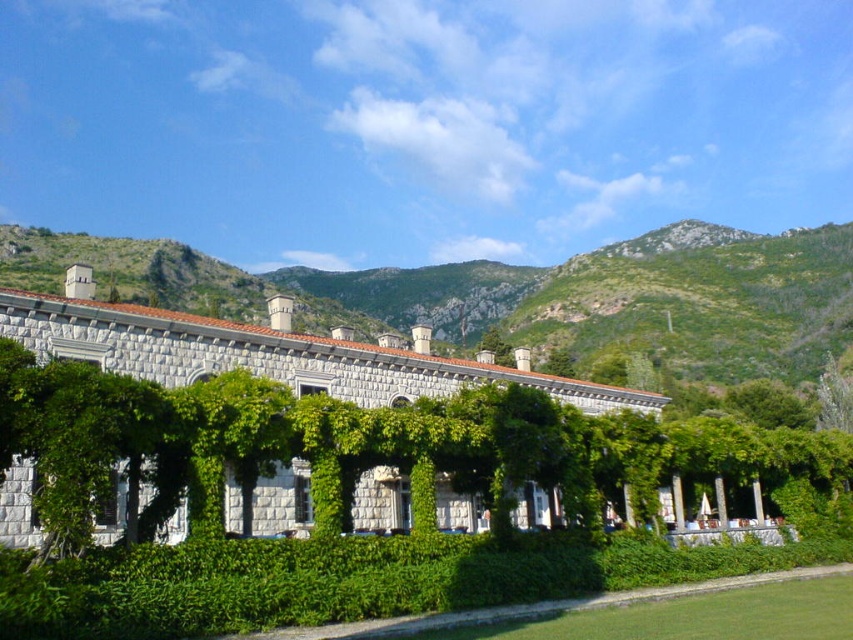
You are standing on the lawn in front of the grand stone building and want to walk towards the building. Which point, point [741,380] or point [770,384], is closer to the building?

Point [741,380] is behind point [770,384], so point [770,384] is closer to the building.

You are standing on the lawn in front of the grand stone building. You see the green grassy hillside at upper center and the green leafy tree at center. Which object is higher in elevation compared to the other?

The green grassy hillside at upper center is taller than the green leafy tree at center, so the green grassy hillside at upper center is higher in elevation.